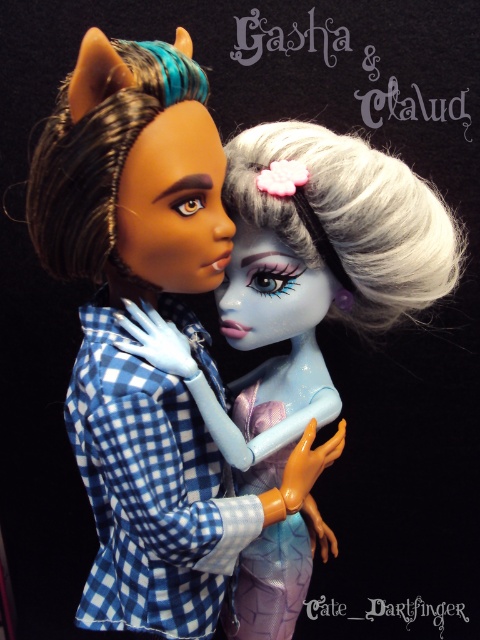
Question: Can you confirm if shiny blue hair at center is wider than matte blue checkered shirt at center?

Choices:
 (A) yes
 (B) no

Answer: (B)

Question: Among these points, which one is nearest to the camera?

Choices:
 (A) coord(266,433)
 (B) coord(173,516)

Answer: (B)

Question: Can you confirm if shiny blue hair at center is positioned below matte blue checkered shirt at center?

Choices:
 (A) yes
 (B) no

Answer: (B)

Question: Is shiny blue hair at center wider than matte blue checkered shirt at center?

Choices:
 (A) no
 (B) yes

Answer: (A)